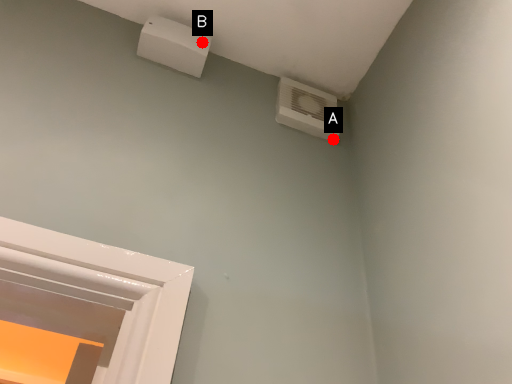
Question: Two points are circled on the image, labeled by A and B beside each circle. Among these points, which one is farthest from the camera?

Choices:
 (A) A is further
 (B) B is further

Answer: (A)